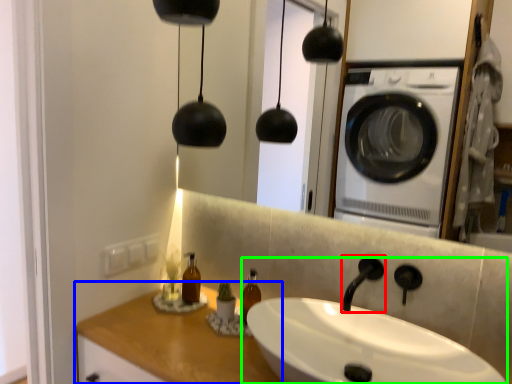
Question: Which object is positioned closest to faucet (highlighted by a red box)? Select from counter top (highlighted by a blue box) and sink (highlighted by a green box).

Choices:
 (A) counter top
 (B) sink

Answer: (B)